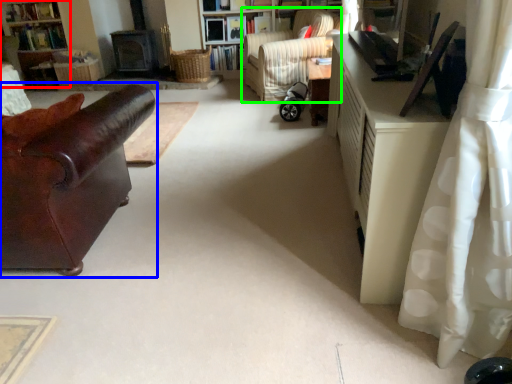
Question: Which object is the closest to the bookshelf (highlighted by a red box)? Choose among these: studio couch (highlighted by a blue box) or chair (highlighted by a green box).

Choices:
 (A) studio couch
 (B) chair

Answer: (B)